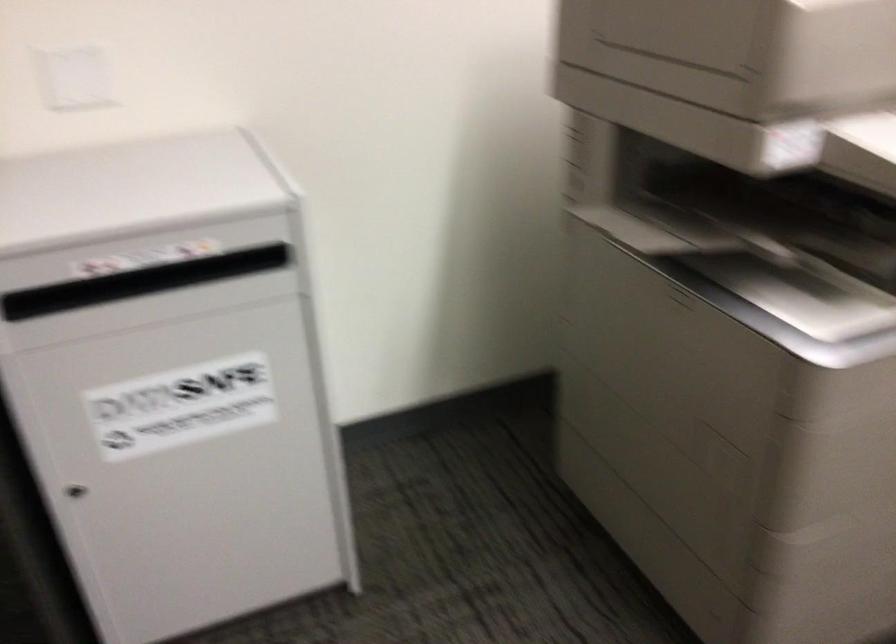
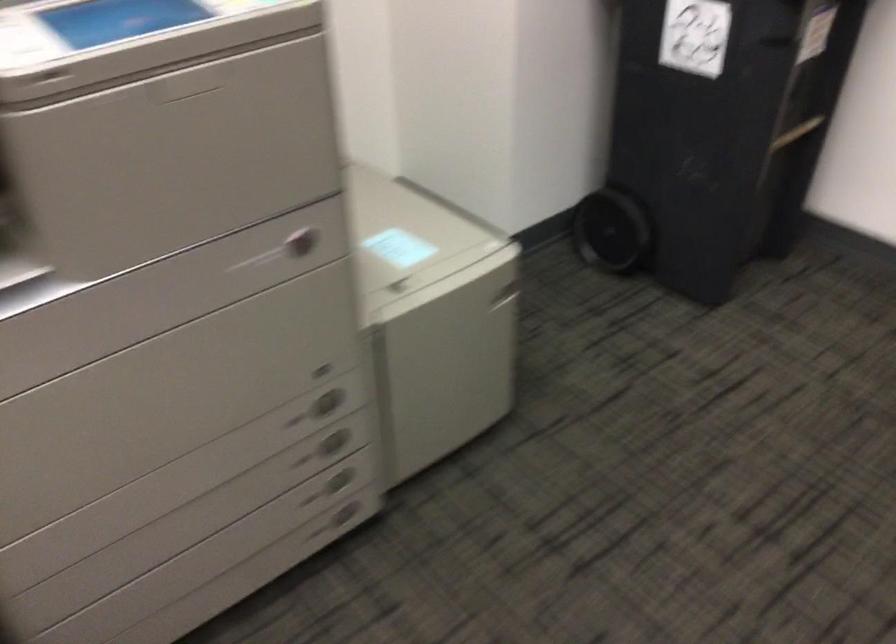
Question: What movement of the cameraman would produce the second image?

Choices:
 (A) Left
 (B) Right
 (C) Forward
 (D) Backward

Answer: (B)